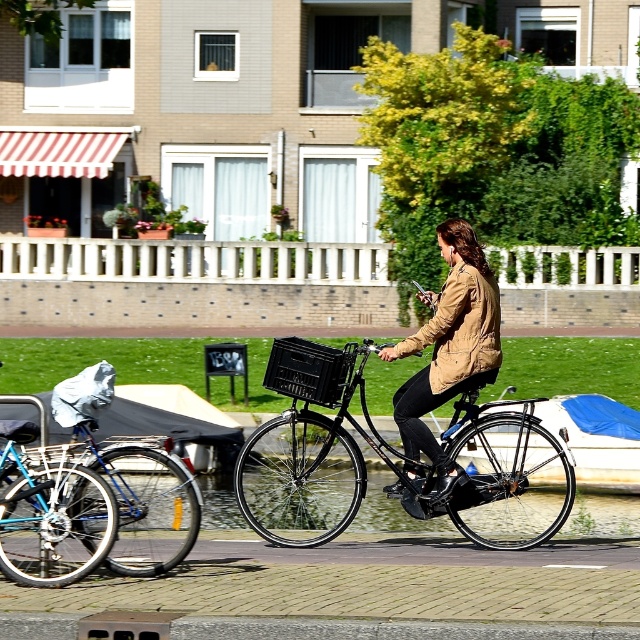
You are a delivery person who needs to load a package onto the black matte bicycle at center. The package is taller than the camouflage jacket at center. Can the package fit on the bicycle without exceeding its height?

The black matte bicycle at center is shorter than the camouflage jacket at center. Since the package is taller than the camouflage jacket at center, it would exceed the bicycle height and not fit.

You are a pedestrian standing at the edge of the sidewalk. You see the black matte bicycle at center and the blue tarpaulin boat at center. Which object is nearer to you?

The black matte bicycle at center is closer to the viewer than the blue tarpaulin boat at center.